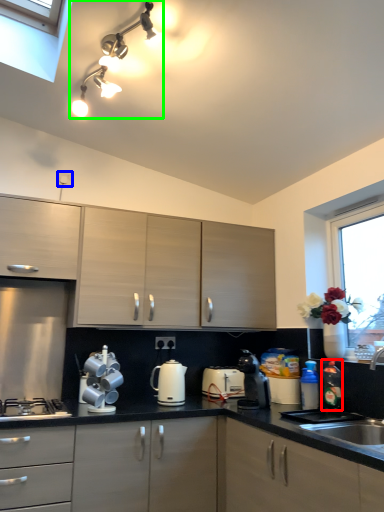
Question: Which object is positioned farthest from bottle (highlighted by a red box)? Select from electric outlet (highlighted by a blue box) and light fixture (highlighted by a green box).

Choices:
 (A) electric outlet
 (B) light fixture

Answer: (A)